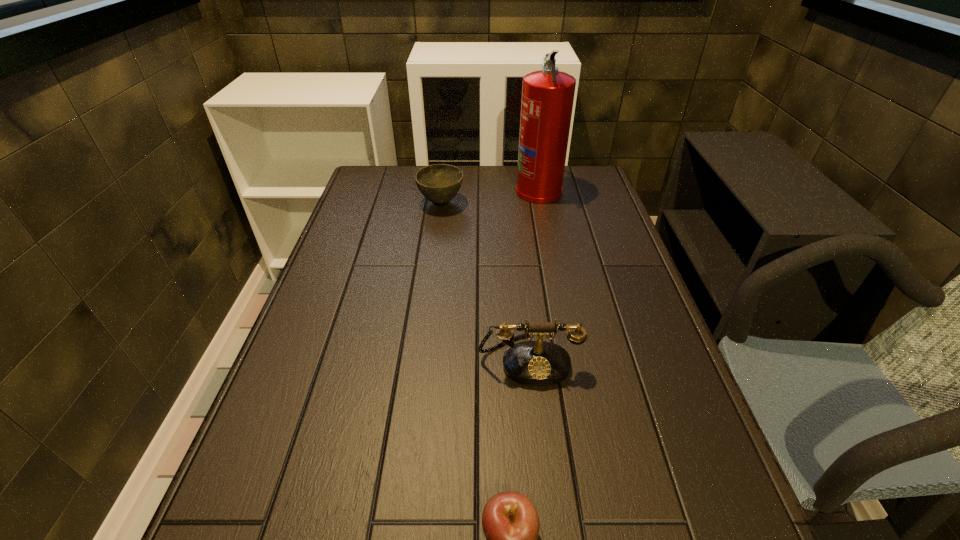
You are a GUI agent. You are given a task and a screenshot of the screen. Output one action in this format:
    pyautogui.click(x=<x>, y=<y>)
    Task: Click on the unoccupied area between the fire extinguisher and the leftmost object
    This screenshot has height=540, width=960.
    Given the screenshot: What is the action you would take?
    pyautogui.click(x=490, y=197)

Where is `free spot between the bowl and the telephone`? This screenshot has width=960, height=540. free spot between the bowl and the telephone is located at coordinates (485, 281).

Image resolution: width=960 pixels, height=540 pixels. I want to click on empty space between the third shortest object and the leftmost object, so click(485, 281).

Find the location of a particular element. vacant space that's between the bowl and the fire extinguisher is located at coordinates (490, 197).

At what (x,y) coordinates should I click in order to perform the action: click on free space between the bowl and the fire extinguisher. Please return your answer as a coordinate pair (x, y). The image size is (960, 540). Looking at the image, I should click on (490, 197).

Locate an element on the screen. Image resolution: width=960 pixels, height=540 pixels. free spot between the second shortest object and the telephone is located at coordinates (485, 281).

Image resolution: width=960 pixels, height=540 pixels. What are the coordinates of `object that is the second closest to the third tallest object` in the screenshot? It's located at (535, 363).

Locate which object ranks in proximity to the nearest object. Please provide its 2D coordinates. Your answer should be formatted as a tuple, i.e. [(x, y)], where the tuple contains the x and y coordinates of a point satisfying the conditions above.

[(535, 363)]